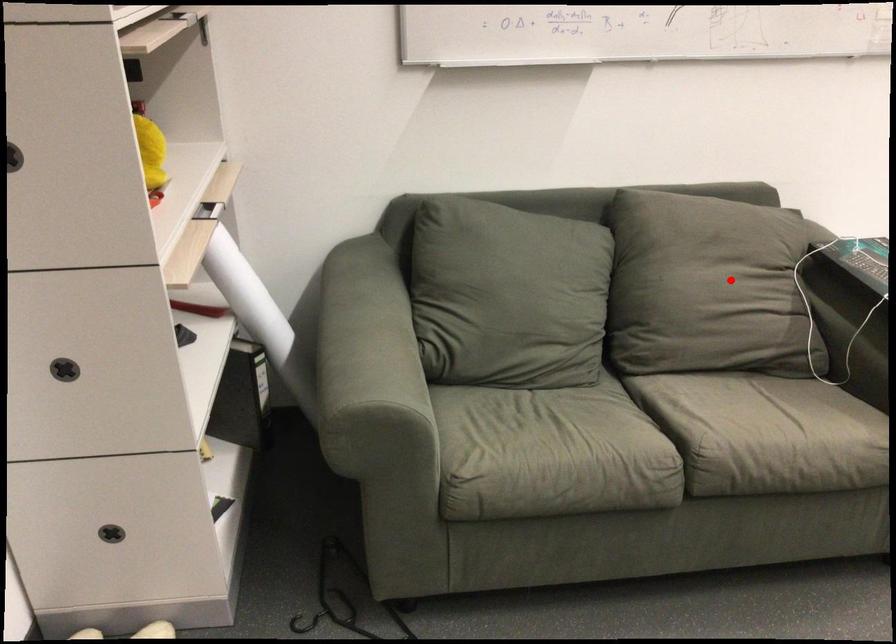
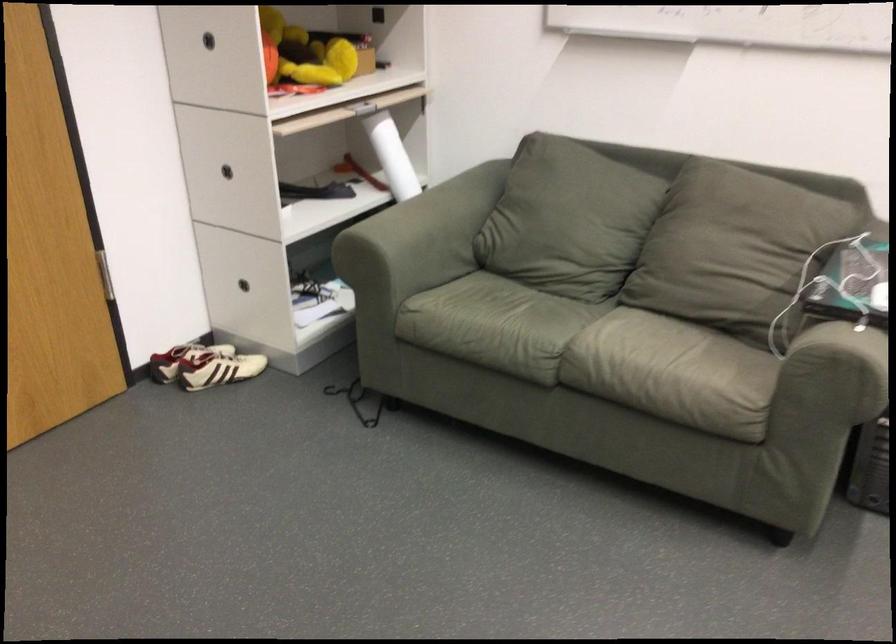
The point at the highlighted location is marked in the first image. Where is the corresponding point in the second image?

(728, 243)